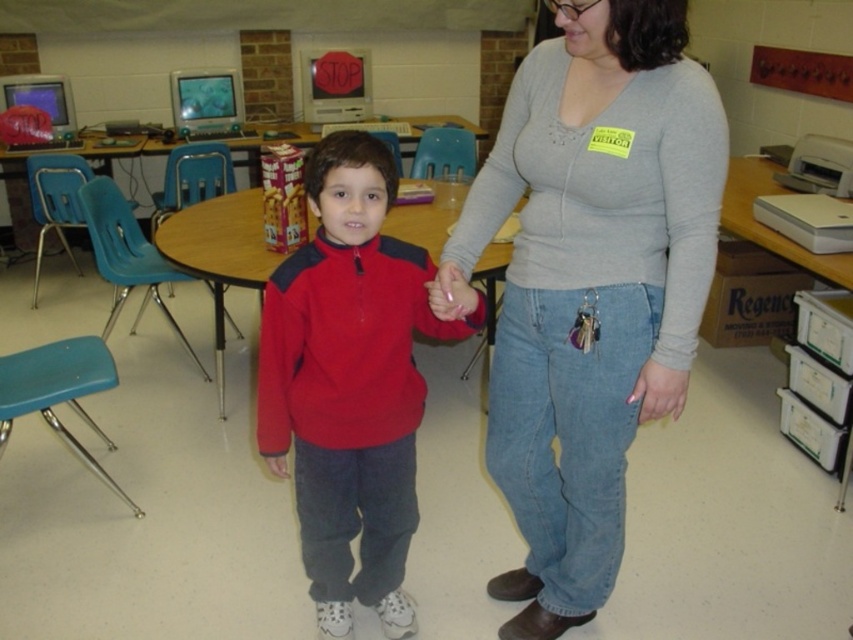
You are a student in the classroom. You see a gray sweater at center and a matte red sweater at center. Which one is on the right side?

The gray sweater at center is on the right side of the matte red sweater at center, so the gray sweater at center is on the right.

You are a tailor who needs to determine which sweater requires more fabric between the gray sweater at center and the matte red sweater at center. Based on the description, which one would need more fabric?

The gray sweater at center has a larger size compared to matte red sweater at center, so it would require more fabric.

You are a photographer trying to capture a clear shot of both the gray sweater at center and the matte red sweater at center. Since you can only focus on one subject at a time, which sweater should you focus on to ensure the other remains relatively in focus?

You should focus on the gray sweater at center because it is closer to the viewer than the matte red sweater at center, so focusing on the closer one will keep the farther one more in focus.